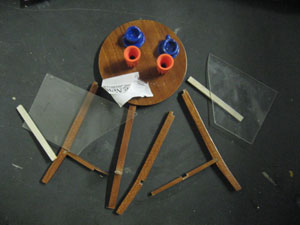
Find the location of a particular element. The height and width of the screenshot is (225, 300). center piece on small brown line is located at coordinates (184, 175).